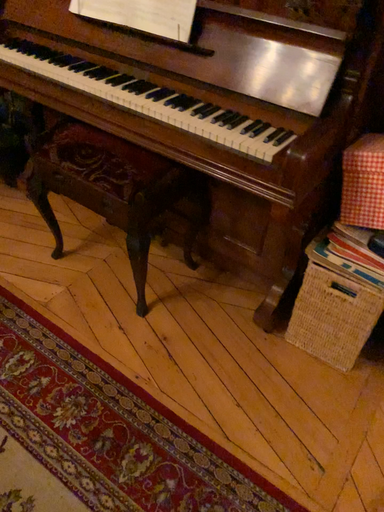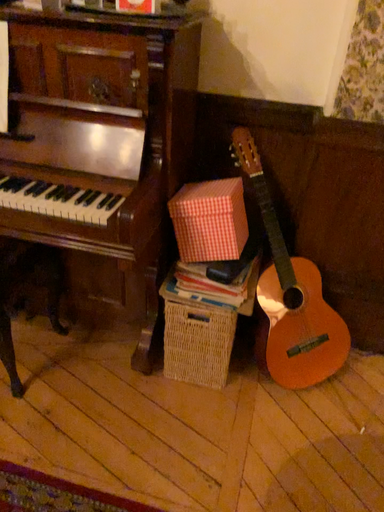
Question: Which way did the camera rotate in the video?

Choices:
 (A) rotated left
 (B) rotated right

Answer: (B)